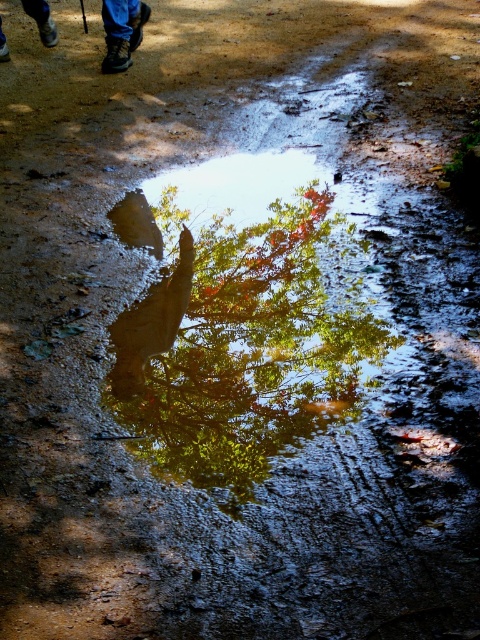
Question: Does green glossy tree at center lie behind blue jeans at upper left?

Choices:
 (A) no
 (B) yes

Answer: (A)

Question: Which object is closer to the camera taking this photo?

Choices:
 (A) blue jeans at upper left
 (B) green glossy tree at center

Answer: (B)

Question: Does green glossy tree at center have a larger size compared to blue jeans at upper left?

Choices:
 (A) yes
 (B) no

Answer: (A)

Question: Does green glossy tree at center have a larger size compared to blue jeans at upper left?

Choices:
 (A) no
 (B) yes

Answer: (B)